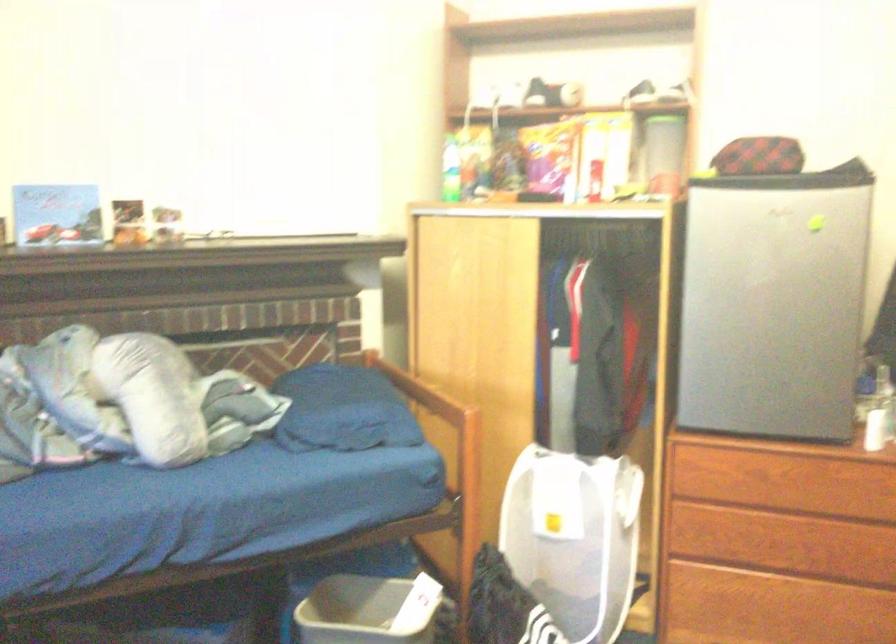
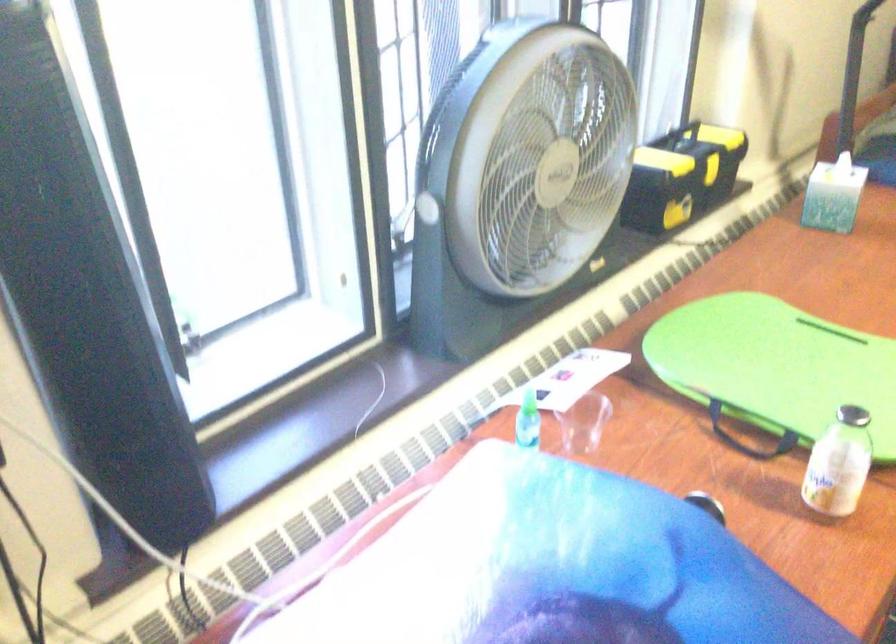
Based on the continuous images, in which direction is the camera rotating?

The rotation direction of the camera is left-down.